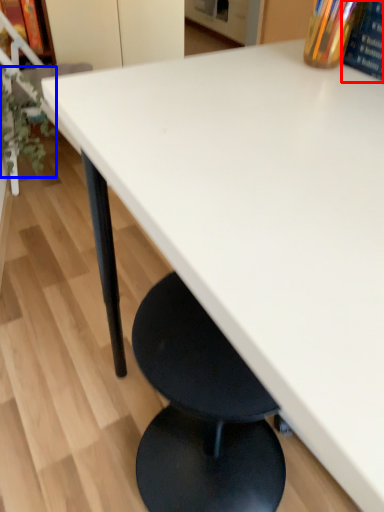
Question: Which of the following is the closest to the observer, paperback book (highlighted by a red box) or plant (highlighted by a blue box)?

Choices:
 (A) paperback book
 (B) plant

Answer: (A)